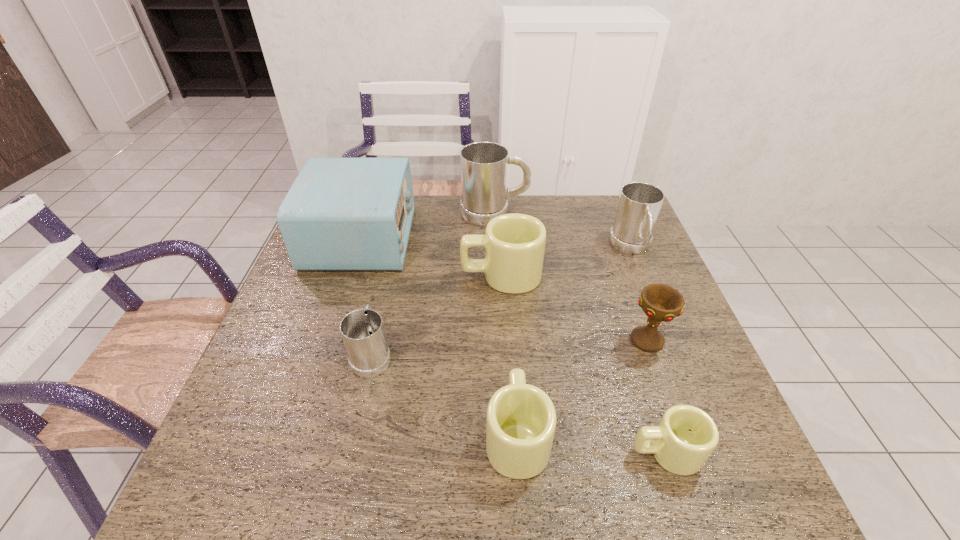
Identify the location of the farthest gray mug. The height and width of the screenshot is (540, 960). (484, 165).

Where is `the tallest mug`? The height and width of the screenshot is (540, 960). the tallest mug is located at coordinates (484, 165).

At what (x,y) coordinates should I click in order to perform the action: click on radio receiver. Please return your answer as a coordinate pair (x, y). Looking at the image, I should click on (340, 213).

What are the coordinates of `the rightmost gray mug` in the screenshot? It's located at (639, 205).

Find the location of a particular element. Image resolution: width=960 pixels, height=540 pixels. the second biggest gray mug is located at coordinates (639, 205).

This screenshot has width=960, height=540. I want to click on the biggest beige mug, so click(x=514, y=244).

This screenshot has height=540, width=960. Find the location of `chalice`. chalice is located at coordinates (661, 303).

Locate an element on the screen. the fourth farthest mug is located at coordinates (362, 330).

Where is `the leftmost mug`? The height and width of the screenshot is (540, 960). the leftmost mug is located at coordinates (362, 330).

Where is `the second smallest beige mug`? the second smallest beige mug is located at coordinates (521, 420).